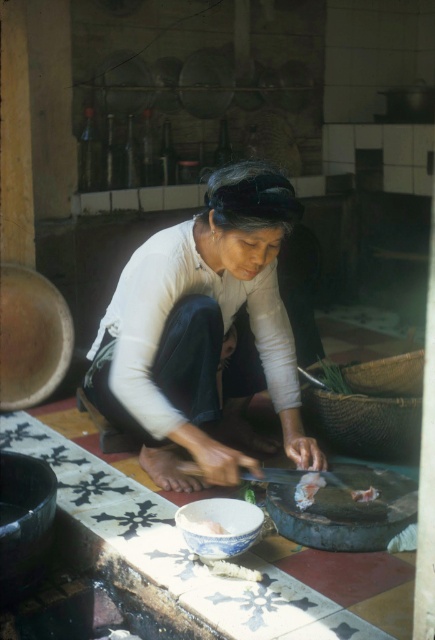
Between white soft food at center and white glossy meat at center, which one has more height?

Standing taller between the two is white soft food at center.

You are a GUI agent. You are given a task and a screenshot of the screen. Output one action in this format:
    pyautogui.click(x=<x>, y=<y>)
    Task: Click on the white soft food at center
    Image resolution: width=435 pixels, height=640 pixels.
    Given the screenshot: What is the action you would take?
    (307, 488)

The width and height of the screenshot is (435, 640). Find the location of `white soft food at center`. white soft food at center is located at coordinates [x=307, y=488].

The width and height of the screenshot is (435, 640). Describe the element at coordinates (204, 333) in the screenshot. I see `white matte fabric at center` at that location.

Can you confirm if white matte fabric at center is positioned above white soft food at center?

Correct, white matte fabric at center is located above white soft food at center.

Locate an element on the screen. This screenshot has height=640, width=435. white matte fabric at center is located at coordinates [204, 333].

Is blue porcelain bowl at lower center wider than white glossy meat at center?

Yes.

Does blue porcelain bowl at lower center have a larger size compared to white glossy meat at center?

Correct, blue porcelain bowl at lower center is larger in size than white glossy meat at center.

Is point (191, 502) farther from viewer compared to point (361, 500)?

No, (191, 502) is in front of (361, 500).

The image size is (435, 640). I want to click on blue porcelain bowl at lower center, so click(218, 525).